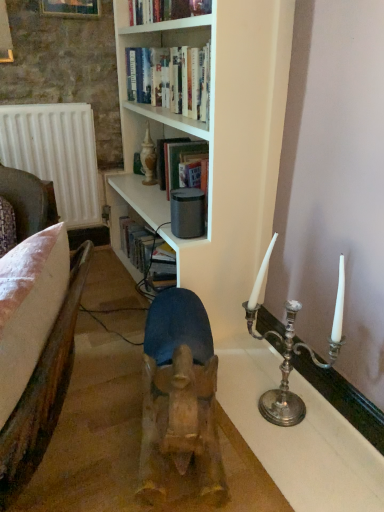
Locate an element on the screen. unoccupied space behind silver metallic candle holder at right is located at coordinates (246, 358).